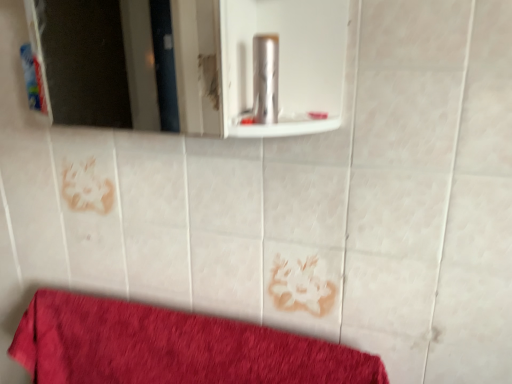
Question: Is red cotton towel at lower left at the right side of white glossy mirror at upper center?

Choices:
 (A) yes
 (B) no

Answer: (A)

Question: Considering the relative sizes of red cotton towel at lower left and white glossy mirror at upper center in the image provided, is red cotton towel at lower left thinner than white glossy mirror at upper center?

Choices:
 (A) yes
 (B) no

Answer: (A)

Question: Is red cotton towel at lower left aimed at white glossy mirror at upper center?

Choices:
 (A) yes
 (B) no

Answer: (B)

Question: From a real-world perspective, is red cotton towel at lower left under white glossy mirror at upper center?

Choices:
 (A) no
 (B) yes

Answer: (B)

Question: From the image's perspective, does red cotton towel at lower left appear lower than white glossy mirror at upper center?

Choices:
 (A) yes
 (B) no

Answer: (A)

Question: Is red cotton towel at lower left not near white glossy mirror at upper center?

Choices:
 (A) no
 (B) yes

Answer: (B)

Question: From the image's perspective, is metallic silver canister at center, placed as the 2th toiletry when sorted from back to front, located beneath red cotton towel at lower left?

Choices:
 (A) yes
 (B) no

Answer: (B)

Question: Does metallic silver canister at center, which is the 1th toiletry from right to left, come behind red cotton towel at lower left?

Choices:
 (A) yes
 (B) no

Answer: (B)

Question: Would you consider metallic silver canister at center, the 1th toiletry when ordered from front to back, to be distant from red cotton towel at lower left?

Choices:
 (A) yes
 (B) no

Answer: (B)

Question: Can red cotton towel at lower left be found inside metallic silver canister at center, acting as the second toiletry starting from the left?

Choices:
 (A) no
 (B) yes

Answer: (A)

Question: From a real-world perspective, does metallic silver canister at center, which is the 1th toiletry from right to left, sit lower than red cotton towel at lower left?

Choices:
 (A) yes
 (B) no

Answer: (B)

Question: Is metallic silver canister at center, placed as the 2th toiletry when sorted from back to front, outside red cotton towel at lower left?

Choices:
 (A) no
 (B) yes

Answer: (B)

Question: Is red cotton towel at lower left surrounding blue plastic toothpaste tube at left, which ranks as the second toiletry in right-to-left order?

Choices:
 (A) no
 (B) yes

Answer: (A)